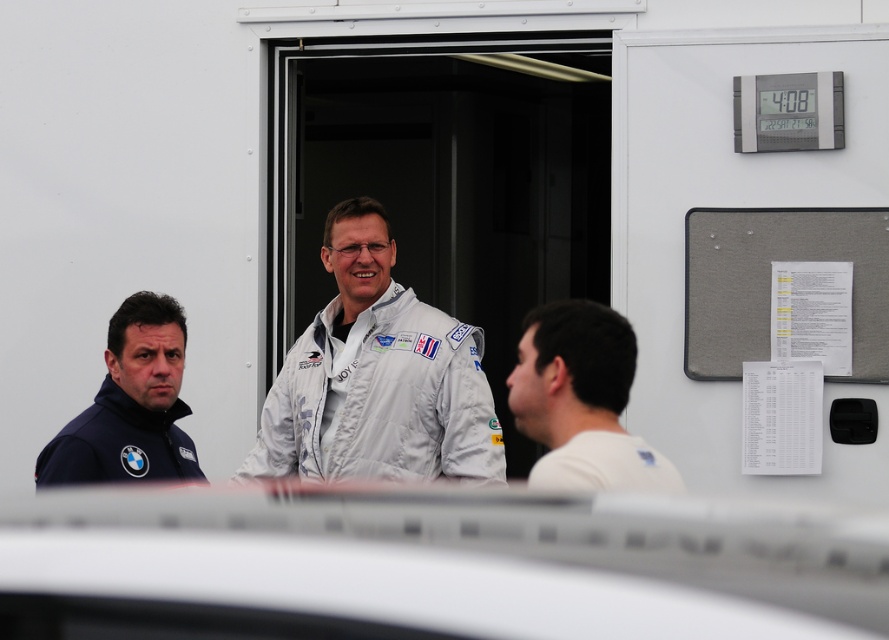
You are a photographer trying to capture a group photo of the white matte shirt at center and the dark blue fabric jacket at left. If you want to ensure both subjects are in focus, which one should you adjust your camera focus on first?

The white matte shirt at center is smaller than the dark blue fabric jacket at left, so you should focus on the smaller subject first to ensure proper depth of field coverage for both.